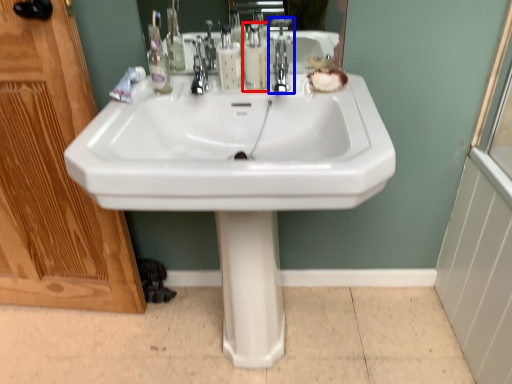
Question: Which object appears closest to the camera in this image, soap dispenser (highlighted by a red box) or tap (highlighted by a blue box)?

Choices:
 (A) soap dispenser
 (B) tap

Answer: (B)